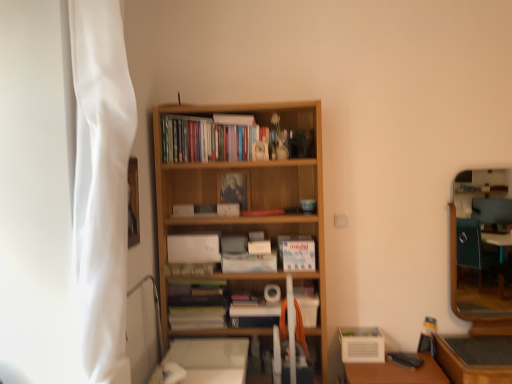
Identify the location of vacant space situated above white matte paperback book at center, placed as the first paperback book when sorted from bottom to top (from a real-world perspective). (247, 253).